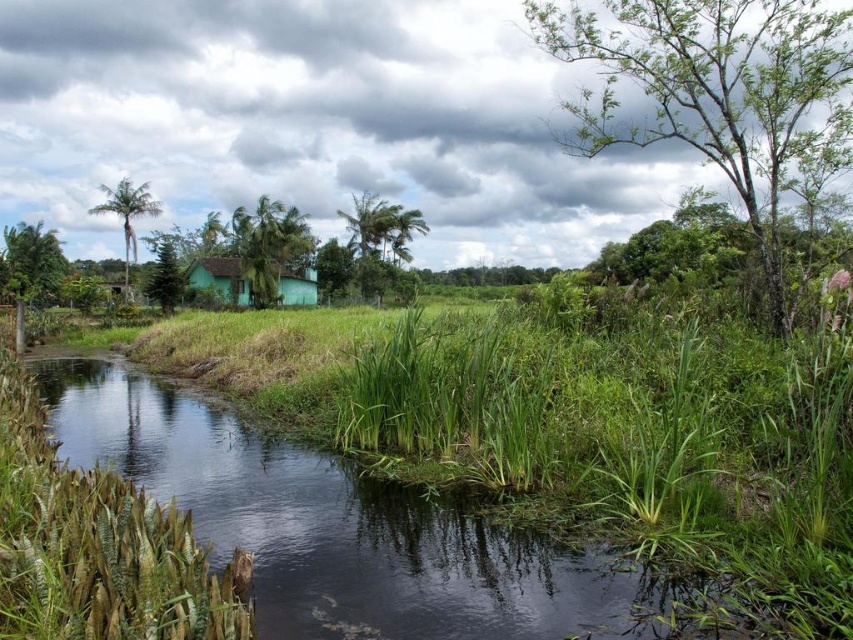
Question: Is green leafy tree at upper right positioned before green leafy palm tree at center?

Choices:
 (A) yes
 (B) no

Answer: (A)

Question: Does green leafy palm tree at center appear over green leafy tree at left?

Choices:
 (A) yes
 (B) no

Answer: (A)

Question: Which object is the farthest from the green matte tree at center-left?

Choices:
 (A) green matte house at center
 (B) green leafy palm tree at upper left

Answer: (A)

Question: Based on their relative distances, which object is nearer to the green matte tree at center-left?

Choices:
 (A) green leafy palm tree at center
 (B) green matte house at center
 (C) green leafy palm tree at upper left
 (D) green leafy tree at left

Answer: (C)

Question: Is green leafy tree at upper right closer to camera compared to green matte tree at center-left?

Choices:
 (A) no
 (B) yes

Answer: (B)

Question: Which point is farther from the camera taking this photo?

Choices:
 (A) (189, 268)
 (B) (54, 291)

Answer: (A)